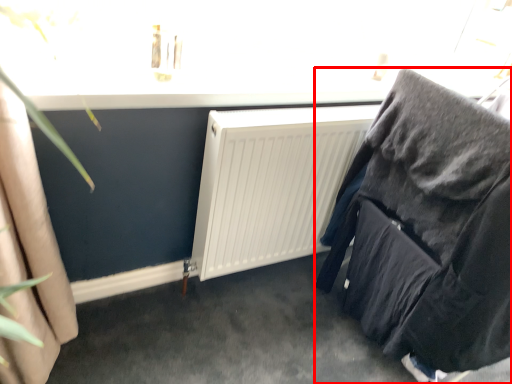
Question: From the image's perspective, where is furniture (annotated by the red box) located in relation to radiator in the image?

Choices:
 (A) below
 (B) above

Answer: (A)